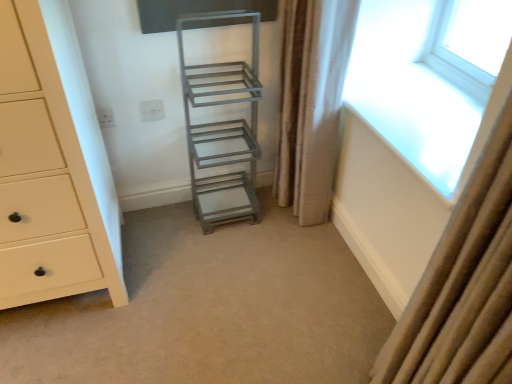
Find the location of a particular element. The height and width of the screenshot is (384, 512). beige fabric curtain at right, the first curtain when ordered from front to back is located at coordinates (455, 273).

What do you see at coordinates (455, 273) in the screenshot? I see `beige fabric curtain at right, the first curtain when ordered from front to back` at bounding box center [455, 273].

Describe the element at coordinates (312, 102) in the screenshot. I see `beige textured curtain at right, which is counted as the second curtain, starting from the right` at that location.

The height and width of the screenshot is (384, 512). What do you see at coordinates (209, 309) in the screenshot? I see `metallic gray ladder at center` at bounding box center [209, 309].

The width and height of the screenshot is (512, 384). Describe the element at coordinates (44, 177) in the screenshot. I see `matte cream chest of drawers at left` at that location.

Identify the location of beige fabric curtain at right, the first curtain when ordered from front to back. (455, 273).

Locate an element on the screen. This screenshot has width=512, height=384. the 1st curtain to the right of the matte cream chest of drawers at left, starting your count from the anchor is located at coordinates (312, 102).

Is beige textured curtain at right, marked as the first curtain in a left-to-right arrangement, facing towards matte cream chest of drawers at left?

Yes, beige textured curtain at right, marked as the first curtain in a left-to-right arrangement, is oriented towards matte cream chest of drawers at left.

Who is taller, beige textured curtain at right, which is counted as the second curtain, starting from the right, or matte cream chest of drawers at left?

With more height is matte cream chest of drawers at left.

Are beige textured curtain at right, marked as the first curtain in a left-to-right arrangement, and matte cream chest of drawers at left far apart?

No, beige textured curtain at right, marked as the first curtain in a left-to-right arrangement, is not far away from matte cream chest of drawers at left.

Is metallic gray ladder at center not within transparent glass window at upper right?

That's correct, metallic gray ladder at center is outside of transparent glass window at upper right.

Considering the positions of points (342, 259) and (380, 93), is point (342, 259) closer to camera compared to point (380, 93)?

No, (342, 259) is behind (380, 93).

Is metallic gray ladder at center to the right of transparent glass window at upper right from the viewer's perspective?

Incorrect, metallic gray ladder at center is not on the right side of transparent glass window at upper right.

How distant is metallic gray ladder at center from matte cream chest of drawers at left?

metallic gray ladder at center and matte cream chest of drawers at left are 43.31 centimeters apart from each other.

From the picture: Is metallic gray ladder at center smaller than matte cream chest of drawers at left?

Yes.

Which object is thinner, metallic gray ladder at center or matte cream chest of drawers at left?

With smaller width is matte cream chest of drawers at left.

Does metallic gray ladder at center have a lesser height compared to matte cream chest of drawers at left?

Indeed, metallic gray ladder at center has a lesser height compared to matte cream chest of drawers at left.

Which is correct: transparent glass window at upper right is inside matte cream chest of drawers at left, or outside of it?

transparent glass window at upper right is not inside matte cream chest of drawers at left, it's outside.

In terms of height, does transparent glass window at upper right look taller or shorter compared to matte cream chest of drawers at left?

In the image, transparent glass window at upper right appears to be shorter than matte cream chest of drawers at left.

From a real-world perspective, is transparent glass window at upper right positioned above or below matte cream chest of drawers at left?

From a real-world perspective, transparent glass window at upper right is physically above matte cream chest of drawers at left.

Considering the sizes of transparent glass window at upper right and matte cream chest of drawers at left in the image, is transparent glass window at upper right wider or thinner than matte cream chest of drawers at left?

Considering their sizes, transparent glass window at upper right looks slimmer than matte cream chest of drawers at left.

Which of these two, matte cream chest of drawers at left or beige textured curtain at right, which is counted as the second curtain, starting from the right, is thinner?

beige textured curtain at right, which is counted as the second curtain, starting from the right, is thinner.

Can we say matte cream chest of drawers at left lies outside beige textured curtain at right, which is counted as the second curtain, starting from the right?

Absolutely, matte cream chest of drawers at left is external to beige textured curtain at right, which is counted as the second curtain, starting from the right.

How many degrees apart are the facing directions of matte cream chest of drawers at left and beige textured curtain at right, which is counted as the second curtain, starting from the right?

They differ by 87.6 degrees in their facing directions.

Can you confirm if matte cream chest of drawers at left is smaller than beige textured curtain at right, which is counted as the second curtain, starting from the right?

Actually, matte cream chest of drawers at left might be larger than beige textured curtain at right, which is counted as the second curtain, starting from the right.

Which is behind, beige fabric curtain at right, which appears as the second curtain when viewed from the left, or metallic gray shelf at center?

metallic gray shelf at center is further from the camera.

From the image's perspective, between beige fabric curtain at right, the first curtain when ordered from front to back, and metallic gray shelf at center, which one is located above?

metallic gray shelf at center is shown above in the image.

Would you say beige fabric curtain at right, which appears as the second curtain when viewed from the left, is inside or outside metallic gray shelf at center?

beige fabric curtain at right, which appears as the second curtain when viewed from the left, exists outside the volume of metallic gray shelf at center.

Is beige textured curtain at right, which is counted as the second curtain, starting from the right, aimed at metallic gray ladder at center?

No, beige textured curtain at right, which is counted as the second curtain, starting from the right, is not aimed at metallic gray ladder at center.

Does beige textured curtain at right, marked as the first curtain in a left-to-right arrangement, contain metallic gray ladder at center?

No, metallic gray ladder at center is located outside of beige textured curtain at right, marked as the first curtain in a left-to-right arrangement.

How distant is beige textured curtain at right, which is counted as the second curtain, starting from the right, from metallic gray ladder at center?

A distance of 22.96 inches exists between beige textured curtain at right, which is counted as the second curtain, starting from the right, and metallic gray ladder at center.

Is point (300, 103) closer or farther from the camera than point (148, 277)?

Point (300, 103) appears to be closer to the viewer than point (148, 277).

Identify the location of the chest of drawers below the beige textured curtain at right, marked as the second curtain in a front-to-back arrangement (from the image's perspective). Image resolution: width=512 pixels, height=384 pixels. (44, 177).

The height and width of the screenshot is (384, 512). Find the location of `window on the right of metallic gray ladder at center`. window on the right of metallic gray ladder at center is located at coordinates (426, 77).

From the image, which object appears to be nearer to metallic gray ladder at center, beige fabric curtain at right, which appears as the second curtain when viewed from the left, or transparent glass window at upper right?

Based on the image, beige fabric curtain at right, which appears as the second curtain when viewed from the left, appears to be nearer to metallic gray ladder at center.

Looking at the image, which one is located further to beige fabric curtain at right, the first curtain when ordered from front to back, metallic gray ladder at center or transparent glass window at upper right?

transparent glass window at upper right lies further to beige fabric curtain at right, the first curtain when ordered from front to back, than the other object.

From the image, which object appears to be farther from beige textured curtain at right, which is counted as the second curtain, starting from the right, metallic gray shelf at center or matte cream chest of drawers at left?

matte cream chest of drawers at left lies further to beige textured curtain at right, which is counted as the second curtain, starting from the right, than the other object.

Which object lies further to the anchor point transparent glass window at upper right, metallic gray ladder at center or beige textured curtain at right, which is counted as the second curtain, starting from the right?

metallic gray ladder at center is positioned further to the anchor transparent glass window at upper right.

Looking at the image, which one is located closer to metallic gray ladder at center, beige textured curtain at right, the 1th curtain when ordered from back to front, or beige fabric curtain at right, which appears as the second curtain when viewed from the left?

beige textured curtain at right, the 1th curtain when ordered from back to front, is positioned closer to the anchor metallic gray ladder at center.

Looking at the image, which one is located further to matte cream chest of drawers at left, transparent glass window at upper right or beige textured curtain at right, the 1th curtain when ordered from back to front?

transparent glass window at upper right lies further to matte cream chest of drawers at left than the other object.

Estimate the real-world distances between objects in this image. Which object is closer to beige textured curtain at right, marked as the first curtain in a left-to-right arrangement, metallic gray ladder at center or transparent glass window at upper right?

transparent glass window at upper right.

Considering their positions, is metallic gray shelf at center positioned closer to beige fabric curtain at right, the first curtain viewed from the right, than beige textured curtain at right, marked as the second curtain in a front-to-back arrangement?

beige textured curtain at right, marked as the second curtain in a front-to-back arrangement, is positioned closer to the anchor beige fabric curtain at right, the first curtain viewed from the right.

Find the location of a particular element. plain between matte cream chest of drawers at left and beige textured curtain at right, which is counted as the second curtain, starting from the right is located at coordinates (209, 309).

Locate an element on the screen. window between beige fabric curtain at right, which appears as the second curtain when viewed from the left, and metallic gray shelf at center in the front-back direction is located at coordinates (426, 77).

Find the location of a particular element. shelf situated between matte cream chest of drawers at left and transparent glass window at upper right from left to right is located at coordinates (222, 122).

This screenshot has height=384, width=512. I want to click on shelf located between matte cream chest of drawers at left and beige textured curtain at right, marked as the second curtain in a front-to-back arrangement, in the left-right direction, so click(x=222, y=122).